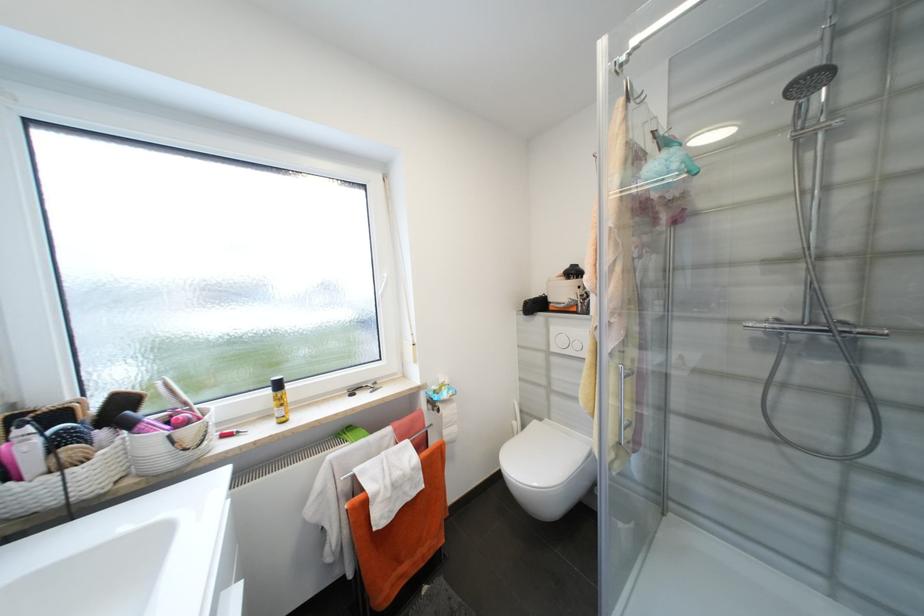
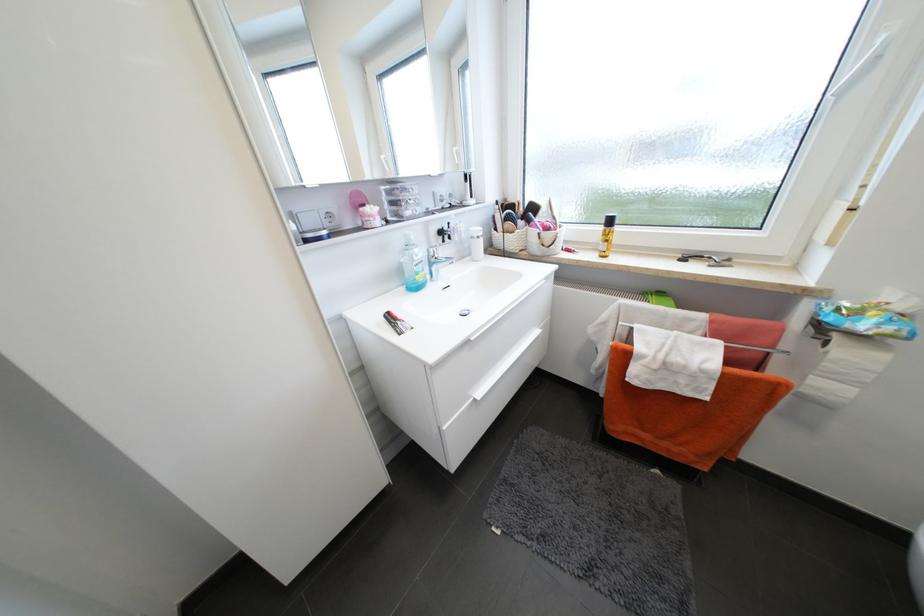
The images are taken continuously from a first-person perspective. In which direction is your viewpoint rotating?

The camera rotated toward left-down.